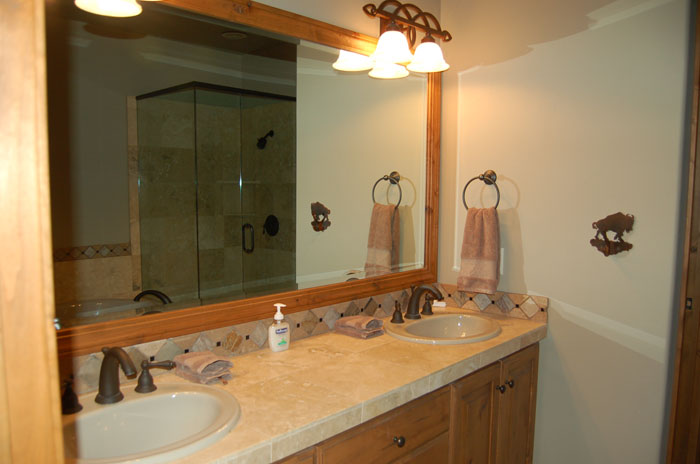
This screenshot has height=464, width=700. I want to click on bull artwork, so click(x=612, y=225).